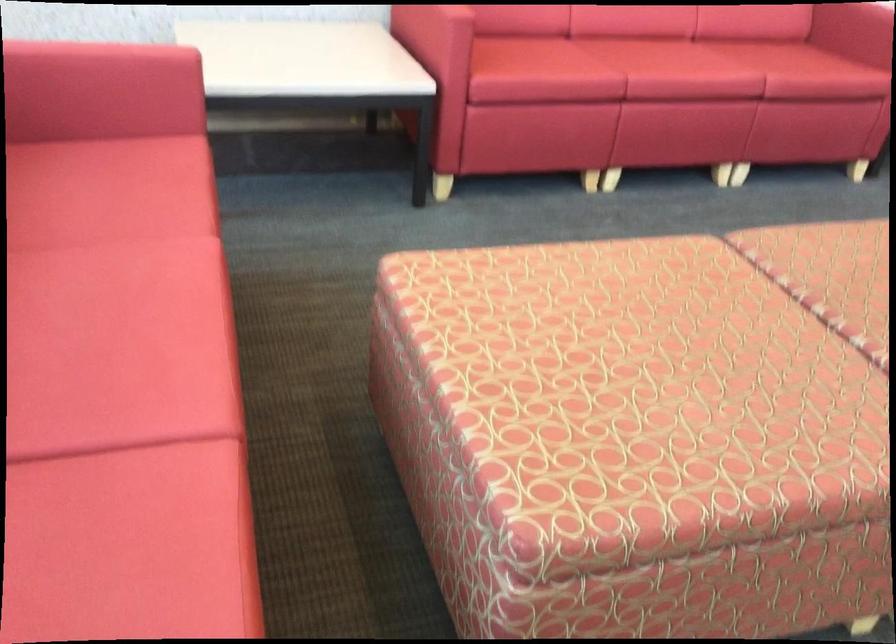
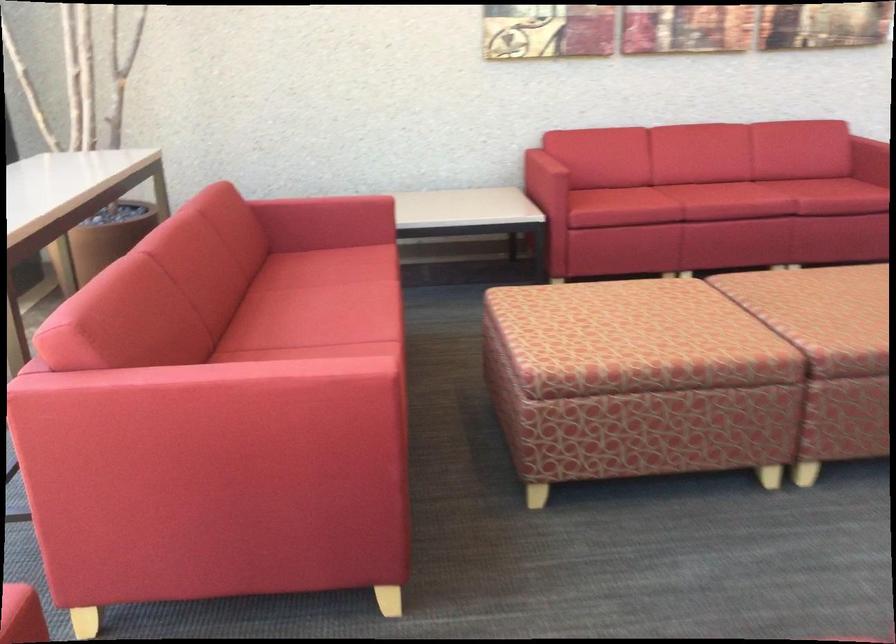
Find the pixel in the second image that matches pixel 76 73 in the first image.

(326, 207)